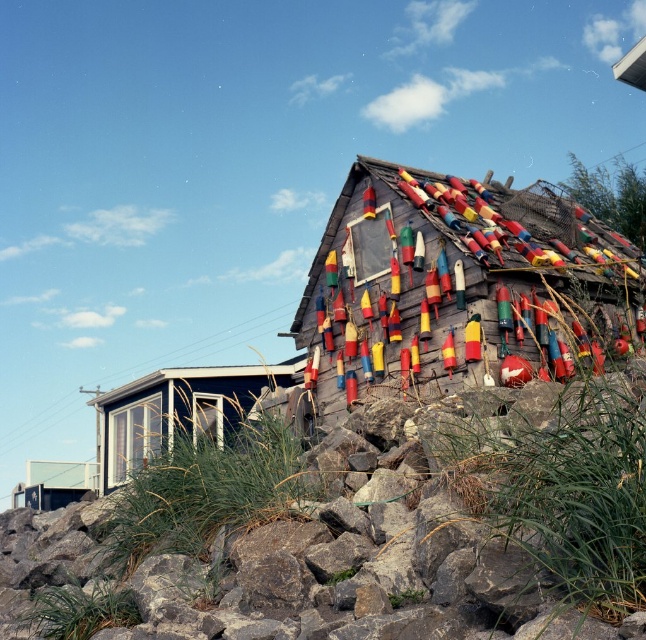
You are a painter planning to paint the wooden buoys at upper right and the matte black cabin at lower left. You need to know which object is taller to estimate the amount of paint required. Based on the scene, which one is taller?

The wooden buoys at upper right has a greater height compared to matte black cabin at lower left, so the wooden buoys at upper right requires more paint due to its taller height.

You are standing in front of the wooden structure and want to hang a new red buoy. The existing wooden buoys at upper right are located at coordinates 0.448, 0.709. Where should you place the new red buoy to maintain symmetry with the existing ones?

To maintain symmetry with the existing wooden buoys at upper right located at coordinates (457, 285), the new red buoy should be placed at the mirrored coordinates relative to the center of the structure.